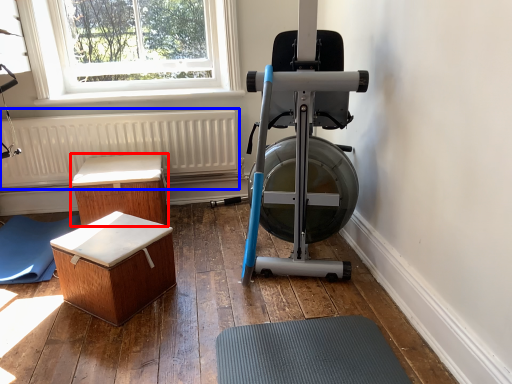
Question: Which point is closer to the camera, furniture (highlighted by a red box) or radiator (highlighted by a blue box)?

Choices:
 (A) furniture
 (B) radiator

Answer: (A)